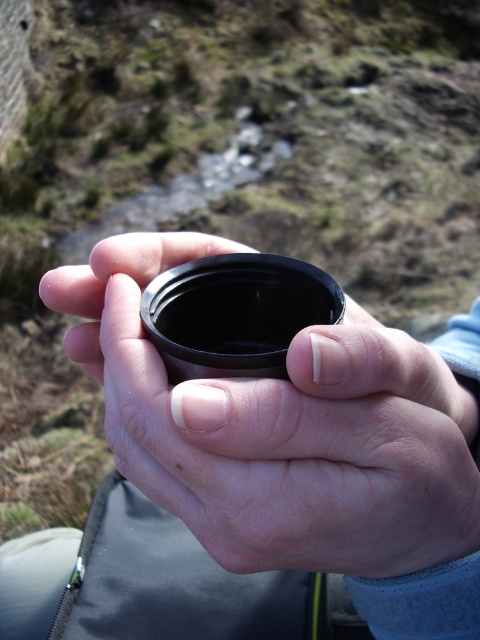
Who is positioned more to the right, black matte cup at center or black matte lens at center?

Positioned to the right is black matte cup at center.

Does black matte cup at center lie in front of black matte lens at center?

Yes, black matte cup at center is in front of black matte lens at center.

Does point (261, 541) come farther from viewer compared to point (208, 262)?

No, (261, 541) is in front of (208, 262).

Locate an element on the screen. Image resolution: width=480 pixels, height=640 pixels. black matte cup at center is located at coordinates (280, 429).